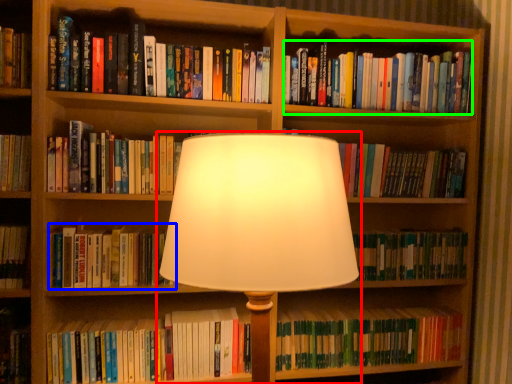
Question: Considering the real-world distances, which object is farthest from lamp (highlighted by a red box)? book (highlighted by a blue box) or book (highlighted by a green box)?

Choices:
 (A) book
 (B) book

Answer: (B)